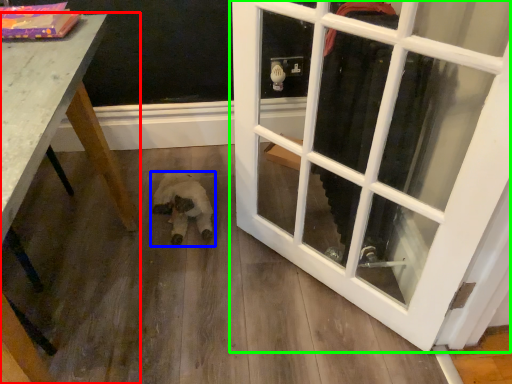
Question: Which is nearer to the table (highlighted by a red box)? animal (highlighted by a blue box) or door (highlighted by a green box).

Choices:
 (A) animal
 (B) door

Answer: (A)